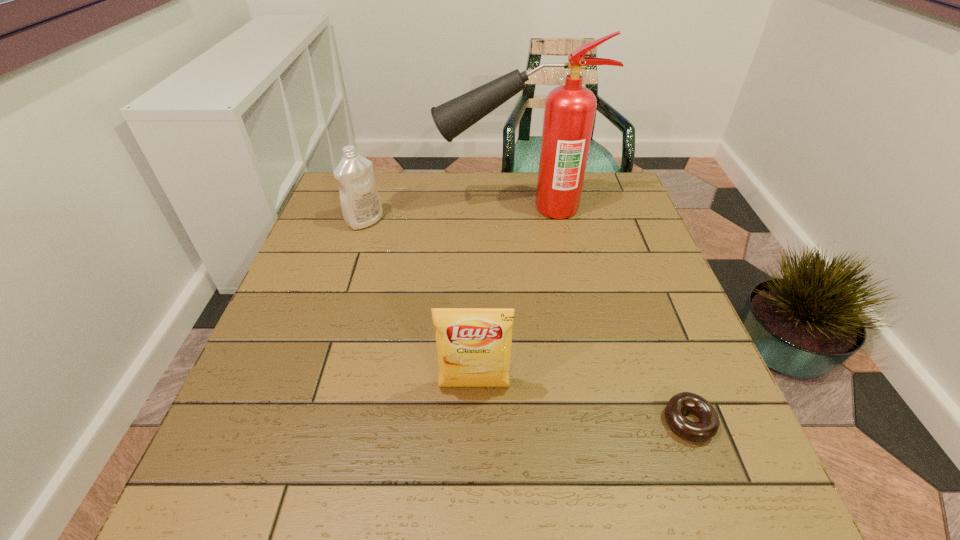
At what (x,y) coordinates should I click in order to perform the action: click on vacant area that lies between the crisp (potato chip) and the fire extinguisher. Please return your answer as a coordinate pair (x, y). Looking at the image, I should click on (495, 298).

At what (x,y) coordinates should I click in order to perform the action: click on vacant area that lies between the second nearest object and the leftmost object. Please return your answer as a coordinate pair (x, y). Looking at the image, I should click on (420, 304).

At what (x,y) coordinates should I click in order to perform the action: click on free space between the third farthest object and the tallest object. Please return your answer as a coordinate pair (x, y). This screenshot has height=540, width=960. Looking at the image, I should click on (495, 298).

Locate an element on the screen. free space between the nearest object and the third farthest object is located at coordinates (582, 404).

Image resolution: width=960 pixels, height=540 pixels. In order to click on free space between the second nearest object and the tallest object in this screenshot , I will do `click(495, 298)`.

Point out which object is positioned as the nearest to the shortest object. Please provide its 2D coordinates. Your answer should be formatted as a tuple, i.e. [(x, y)], where the tuple contains the x and y coordinates of a point satisfying the conditions above.

[(474, 345)]

You are a GUI agent. You are given a task and a screenshot of the screen. Output one action in this format:
    pyautogui.click(x=<x>, y=<y>)
    Task: Click on the object that stands as the second closest to the leftmost object
    The height and width of the screenshot is (540, 960).
    Given the screenshot: What is the action you would take?
    pyautogui.click(x=474, y=345)

Image resolution: width=960 pixels, height=540 pixels. I want to click on vacant space that satisfies the following two spatial constraints: 1. at the nozzle of the shortest object; 2. on the left side of the tallest object, so pos(539,422).

The height and width of the screenshot is (540, 960). Find the location of `free space that satisfies the following two spatial constraints: 1. at the nozzle of the tallest object; 2. on the left side of the doughnut`. free space that satisfies the following two spatial constraints: 1. at the nozzle of the tallest object; 2. on the left side of the doughnut is located at coordinates (539, 422).

The height and width of the screenshot is (540, 960). Identify the location of vacant point that satisfies the following two spatial constraints: 1. at the nozzle of the doughnut; 2. on the left side of the fire extinguisher. (539, 422).